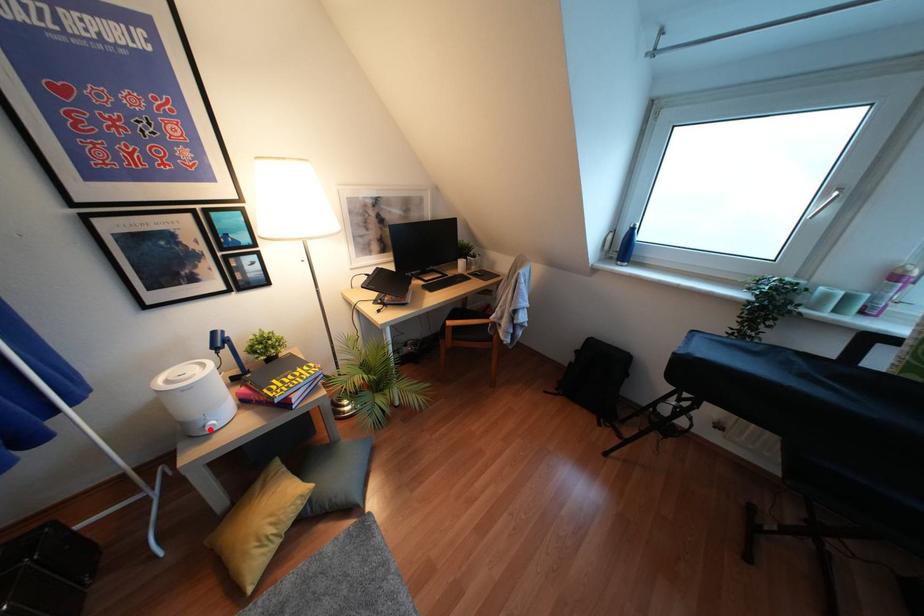
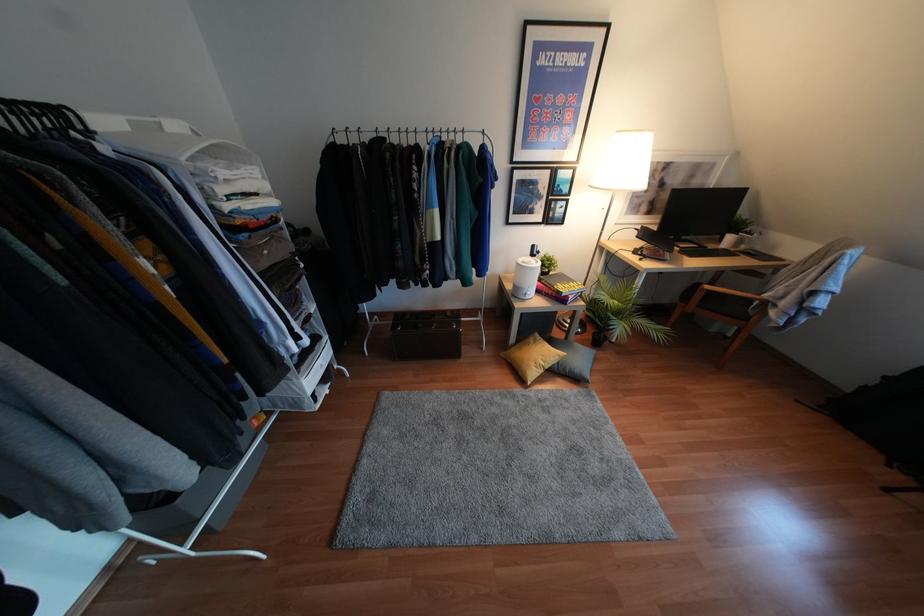
In the second image, find the point that corresponds to the highlighted location in the first image.

(526, 297)